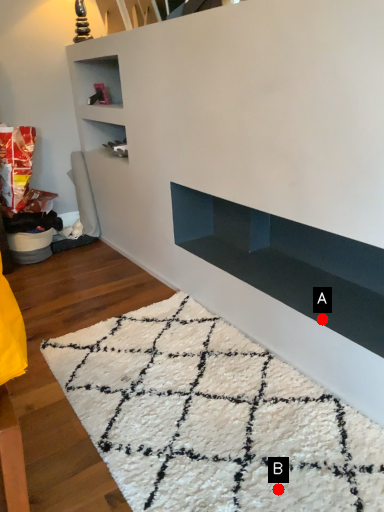
Question: Two points are circled on the image, labeled by A and B beside each circle. Among these points, which one is farthest from the camera?

Choices:
 (A) A is further
 (B) B is further

Answer: (A)